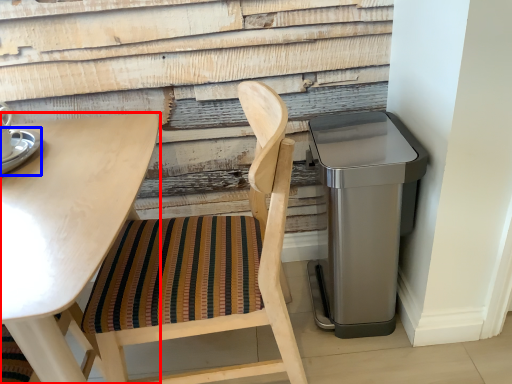
Question: Which of the following is the farthest to the observer, table (highlighted by a red box) or saucer (highlighted by a blue box)?

Choices:
 (A) table
 (B) saucer

Answer: (B)